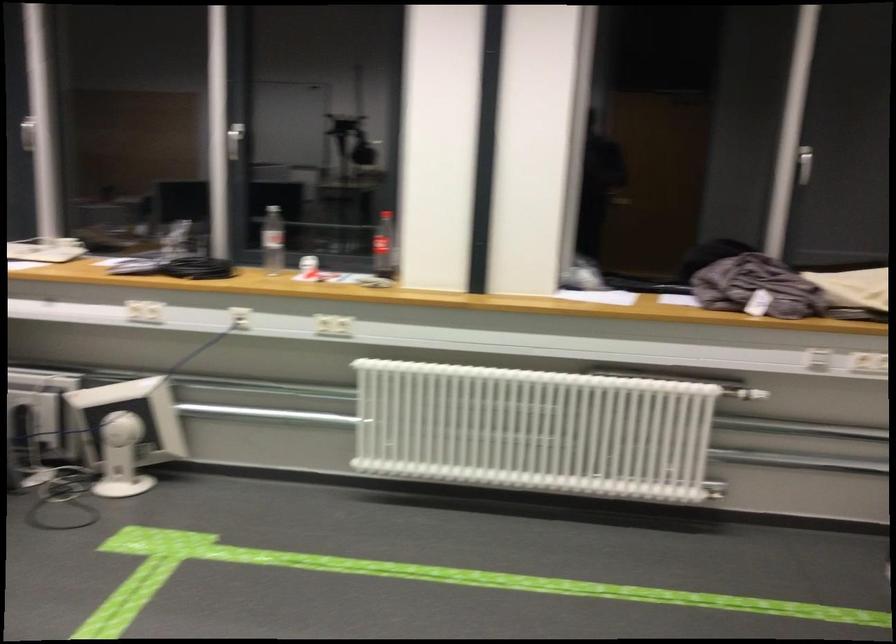
Which object does [271,240] point to?

It refers to a clear plastic bottle.